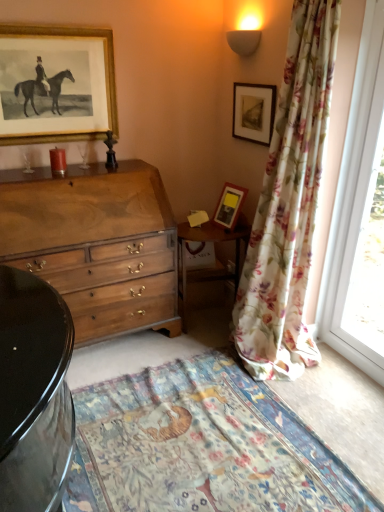
Find the location of a particular element. Image resolution: width=384 pixels, height=512 pixels. free space in front of floral fabric curtain at right is located at coordinates (322, 405).